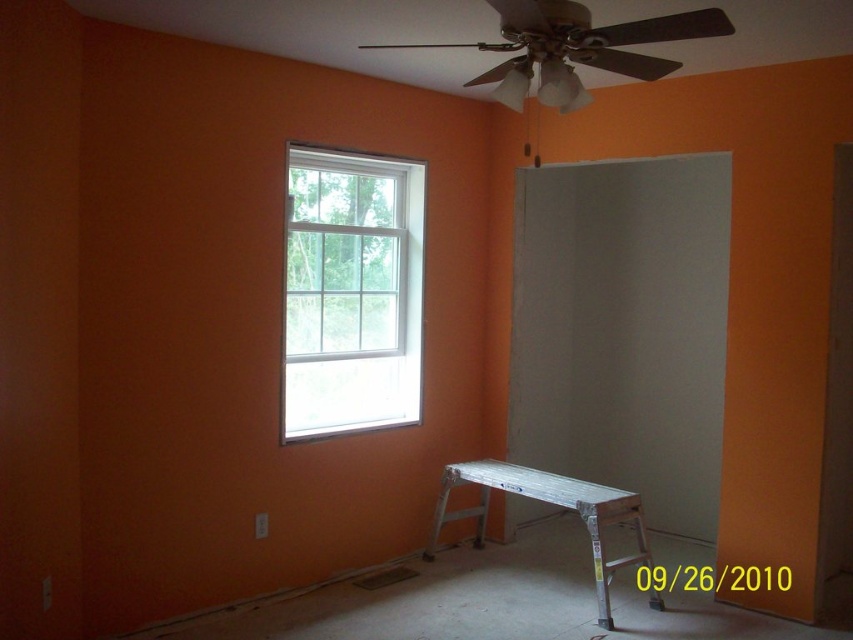
Question: Which point is farther to the camera?

Choices:
 (A) (331, 348)
 (B) (550, 476)

Answer: (A)

Question: Is clear glass window at upper left further to the viewer compared to silver metallic stool at lower right?

Choices:
 (A) no
 (B) yes

Answer: (B)

Question: Is clear glass window at upper left smaller than silver metallic stool at lower right?

Choices:
 (A) yes
 (B) no

Answer: (A)

Question: Can you confirm if clear glass window at upper left is positioned to the left of silver metallic stool at lower right?

Choices:
 (A) yes
 (B) no

Answer: (A)

Question: Among these objects, which one is nearest to the camera?

Choices:
 (A) silver metallic stool at lower right
 (B) clear glass window at upper left

Answer: (A)